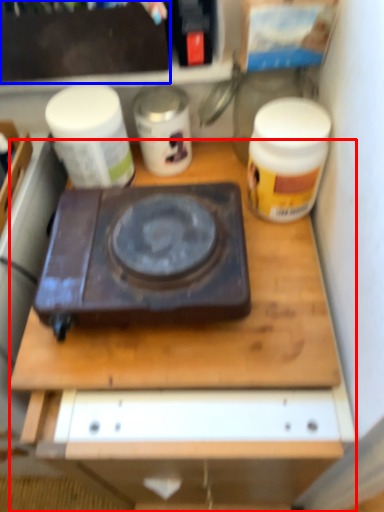
Question: Which of the following is the farthest to the observer, desk (highlighted by a red box) or box (highlighted by a blue box)?

Choices:
 (A) desk
 (B) box

Answer: (B)